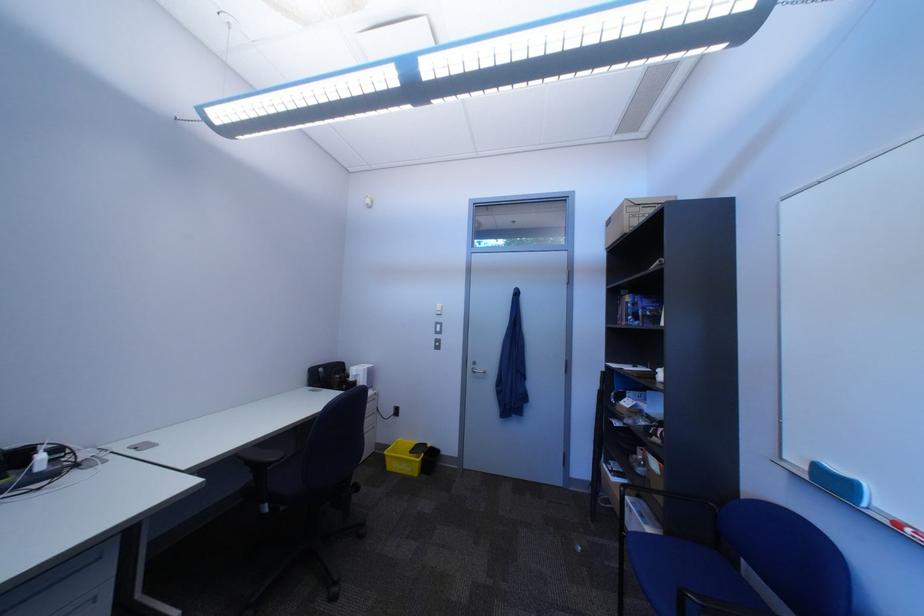
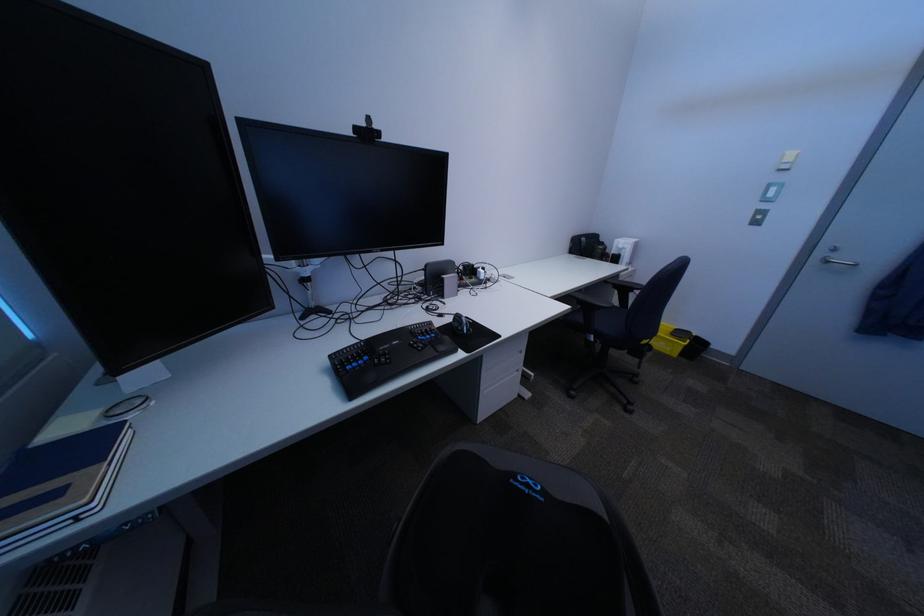
Where in the second image is the point corresponding to [367,381] from the first image?

(628, 254)